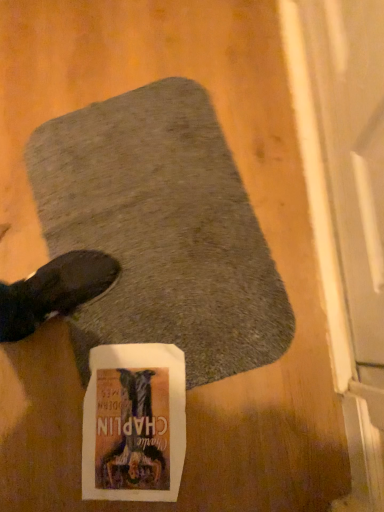
This screenshot has width=384, height=512. I want to click on free space behind gray soft rug at center, so click(94, 79).